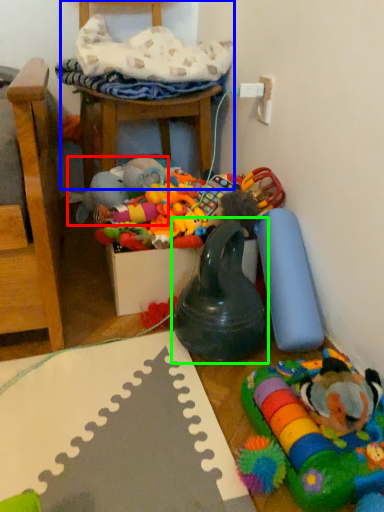
Question: Which is farther away from toy (highlighted by a red box)? chair (highlighted by a blue box) or toy (highlighted by a green box)?

Choices:
 (A) chair
 (B) toy

Answer: (B)